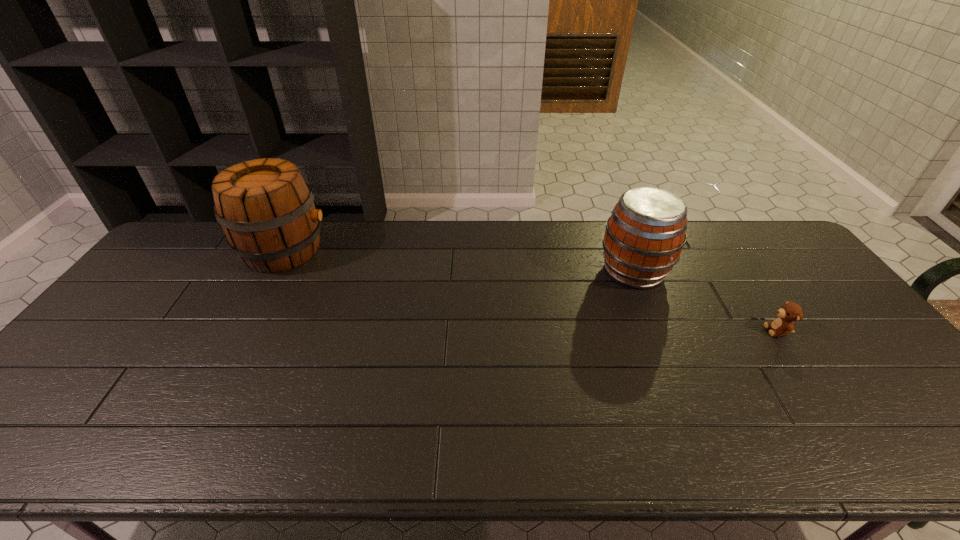
Identify the location of the left cider. (266, 209).

The height and width of the screenshot is (540, 960). What are the coordinates of `the right cider` in the screenshot? It's located at (644, 236).

The image size is (960, 540). I want to click on the rightmost object, so click(x=787, y=314).

Locate an element on the screen. the nearest object is located at coordinates (787, 314).

This screenshot has width=960, height=540. Identify the location of vacant space positioned 0.400m on the side of the leftmost object where the spigot is located. (449, 251).

Image resolution: width=960 pixels, height=540 pixels. In order to click on vacant space located on the right of the second object from left to right in this screenshot , I will do `click(698, 271)`.

The width and height of the screenshot is (960, 540). I want to click on blank space located 0.160m on the face of the nearest object, so click(708, 330).

Where is `vacant area situated on the face of the nearest object`? This screenshot has width=960, height=540. vacant area situated on the face of the nearest object is located at coordinates (637, 330).

Image resolution: width=960 pixels, height=540 pixels. In order to click on free space located 0.270m on the face of the nearest object in this screenshot , I will do `click(667, 330)`.

At what (x,y) coordinates should I click in order to perform the action: click on free spot at the far edge of the desktop. Please return your answer as a coordinate pair (x, y). The image size is (960, 540). Looking at the image, I should click on (231, 251).